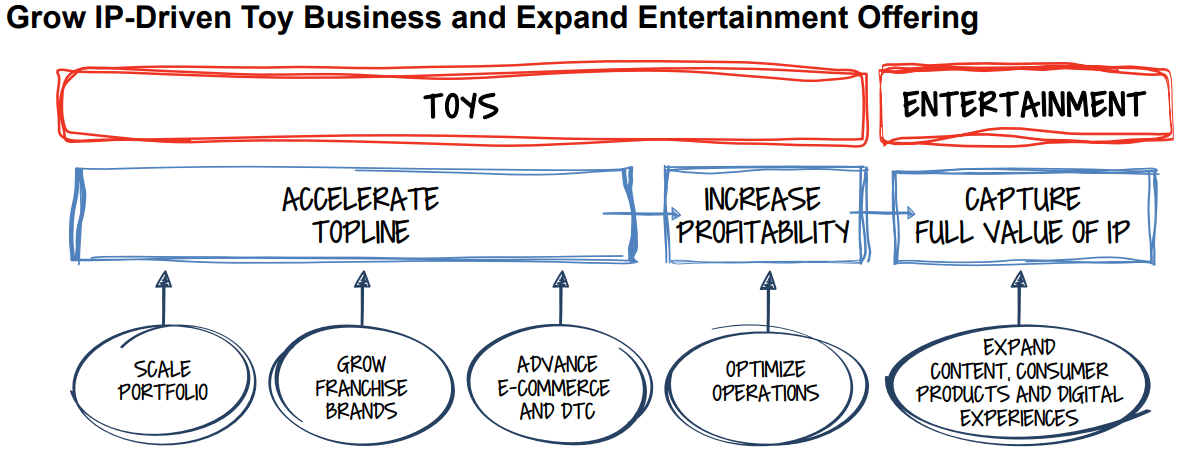
Locate an element on the screen. toys is located at coordinates (452, 115).